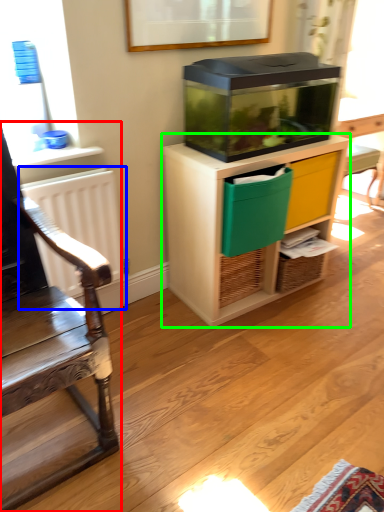
Question: Based on their relative distances, which object is farther from chair (highlighted by a red box)? Choose from radiator (highlighted by a blue box) and cabinetry (highlighted by a green box).

Choices:
 (A) radiator
 (B) cabinetry

Answer: (B)